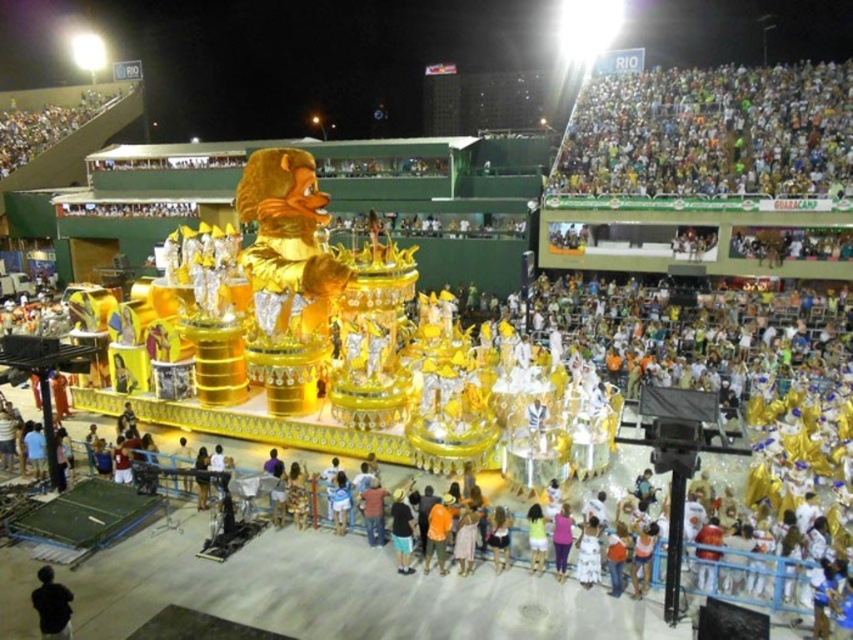
Question: Is white cloth crowd at upper right smaller than black matte jacket at lower left?

Choices:
 (A) no
 (B) yes

Answer: (A)

Question: Among these objects, which one is nearest to the camera?

Choices:
 (A) white cloth crowd at upper right
 (B) black matte jacket at lower left

Answer: (B)

Question: From the image, what is the correct spatial relationship of white cloth crowd at upper right in relation to black matte jacket at lower left?

Choices:
 (A) above
 (B) below

Answer: (A)

Question: Which object is farther from the camera taking this photo?

Choices:
 (A) white cloth crowd at upper right
 (B) black matte jacket at lower left

Answer: (A)

Question: Does white cloth crowd at upper right appear under black matte jacket at lower left?

Choices:
 (A) yes
 (B) no

Answer: (B)